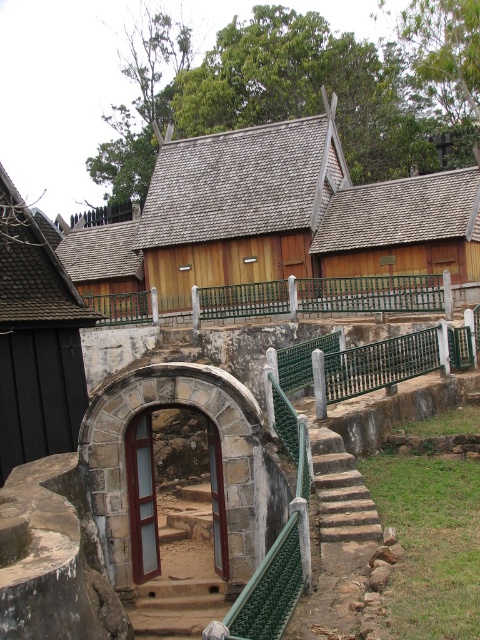
You are an architect analyzing the rustic scene. You need to determine which object takes up more area in the image between the dark brown wood at left and the green metal railing at center. Which one occupies a larger area?

The green metal railing at center occupies more area than the dark brown wood at left because the dark brown wood at left occupies less space than green metal railing at center.

You are standing on the green metal railing at center and want to reach the dark brown wood at left. Can you step directly onto it from your current position?

The dark brown wood at left is positioned over the green metal railing at center, so you cannot step directly onto it from your current position because it is above you.

You are an interior designer planning to place a 2 meter wide sofa in this room. Given the dark brown wood at left and the stone textured stairs at center, which object has enough space for the sofa?

The stone textured stairs at center has a width greater than the dark brown wood at left, so the sofa can be placed near the stone textured stairs at center.